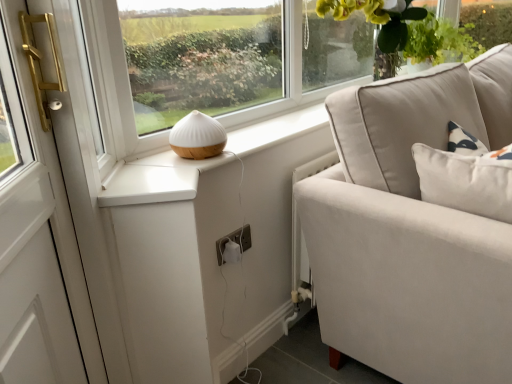
Question: Would you say white plastic electric outlet at lower center is outside green leafy plant at upper right?

Choices:
 (A) yes
 (B) no

Answer: (A)

Question: Considering the relative sizes of white plastic electric outlet at lower center and green leafy plant at upper right in the image provided, is white plastic electric outlet at lower center taller than green leafy plant at upper right?

Choices:
 (A) yes
 (B) no

Answer: (B)

Question: From the image's perspective, does white plastic electric outlet at lower center appear higher than green leafy plant at upper right?

Choices:
 (A) no
 (B) yes

Answer: (A)

Question: Is green leafy plant at upper right at the back of white plastic electric outlet at lower center?

Choices:
 (A) no
 (B) yes

Answer: (A)

Question: Does white plastic electric outlet at lower center have a larger size compared to green leafy plant at upper right?

Choices:
 (A) yes
 (B) no

Answer: (B)

Question: Does white plastic electric outlet at lower center have a greater width compared to green leafy plant at upper right?

Choices:
 (A) yes
 (B) no

Answer: (B)

Question: Is white matte table lamp at center taller than white plastic electric outlet at lower center?

Choices:
 (A) no
 (B) yes

Answer: (B)

Question: From a real-world perspective, is white matte table lamp at center over white plastic electric outlet at lower center?

Choices:
 (A) yes
 (B) no

Answer: (A)

Question: Can you confirm if white matte table lamp at center is shorter than white plastic electric outlet at lower center?

Choices:
 (A) yes
 (B) no

Answer: (B)

Question: Considering the relative sizes of white matte table lamp at center and white plastic electric outlet at lower center in the image provided, is white matte table lamp at center wider than white plastic electric outlet at lower center?

Choices:
 (A) yes
 (B) no

Answer: (A)

Question: Is white matte table lamp at center looking in the opposite direction of white plastic electric outlet at lower center?

Choices:
 (A) yes
 (B) no

Answer: (B)

Question: Is white matte table lamp at center positioned far away from white plastic electric outlet at lower center?

Choices:
 (A) no
 (B) yes

Answer: (A)

Question: Can you confirm if white matte table lamp at center is positioned to the right of green leafy plant at upper right?

Choices:
 (A) no
 (B) yes

Answer: (A)